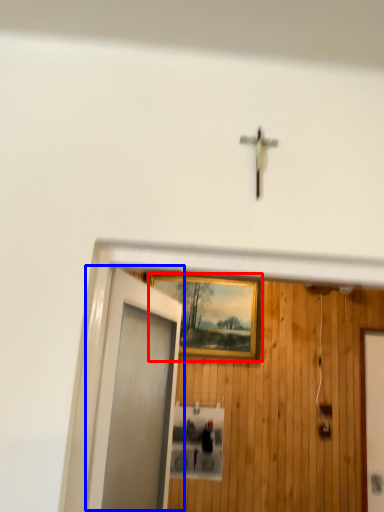
Question: Which of the following is the farthest to the observer, picture frame (highlighted by a red box) or door (highlighted by a blue box)?

Choices:
 (A) picture frame
 (B) door

Answer: (A)